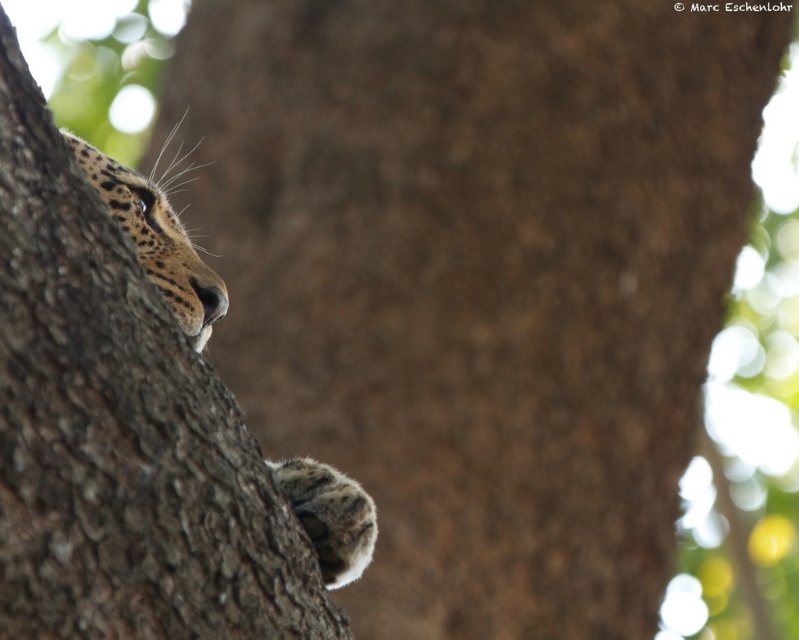
Question: Which object is farther from the camera taking this photo?

Choices:
 (A) brown rough tree trunk at left
 (B) spotted fur paw at lower center

Answer: (B)

Question: In this image, where is brown rough tree trunk at left located relative to spotted fur paw at lower center?

Choices:
 (A) below
 (B) above

Answer: (B)

Question: Is brown rough tree trunk at left positioned behind spotted fur paw at lower center?

Choices:
 (A) no
 (B) yes

Answer: (A)

Question: Is brown rough tree trunk at left positioned in front of spotted fur paw at lower center?

Choices:
 (A) yes
 (B) no

Answer: (A)